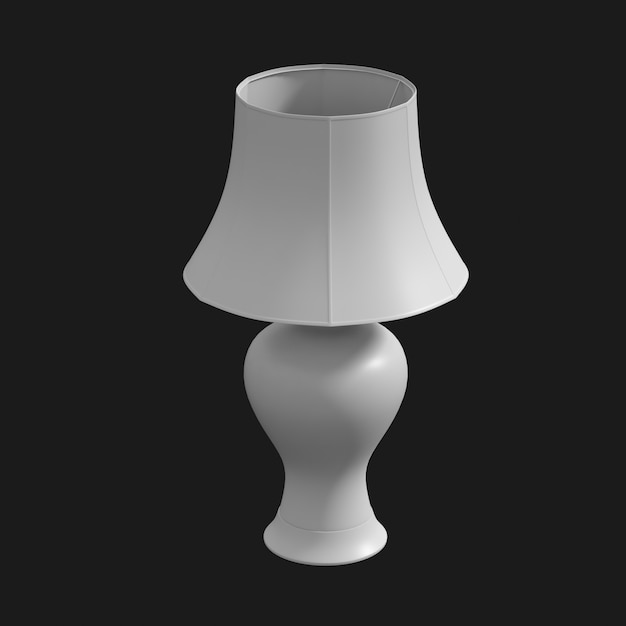
Where is `ceramic lamp`? This screenshot has width=626, height=626. ceramic lamp is located at coordinates (322, 389).